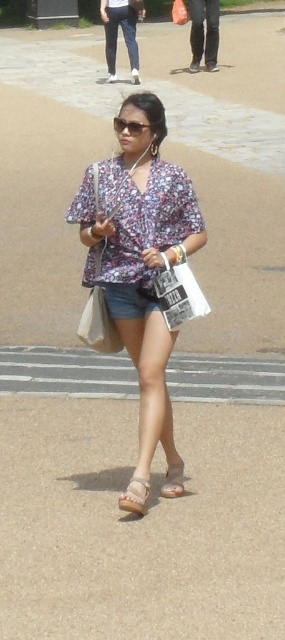
Question: Can you confirm if floral fabric blouse at center is positioned to the left of denim shorts at center?

Choices:
 (A) yes
 (B) no

Answer: (B)

Question: Which object appears closest to the camera in this image?

Choices:
 (A) floral fabric blouse at center
 (B) brown leather sandal at lower center
 (C) smooth concrete sidewalk at center

Answer: (A)

Question: Among these points, which one is nearest to the camera?

Choices:
 (A) (141, 509)
 (B) (188, 273)
 (C) (129, 124)
 (D) (176, 492)

Answer: (A)

Question: Among these points, which one is farthest from the camera?

Choices:
 (A) (206, 304)
 (B) (237, 388)
 (C) (137, 493)
 (D) (169, 336)

Answer: (B)

Question: Does light beige suede sandal at lower center come behind brown leather sandal at lower center?

Choices:
 (A) no
 (B) yes

Answer: (A)

Question: Does white paper bag at center have a lesser width compared to denim shorts at center?

Choices:
 (A) no
 (B) yes

Answer: (B)